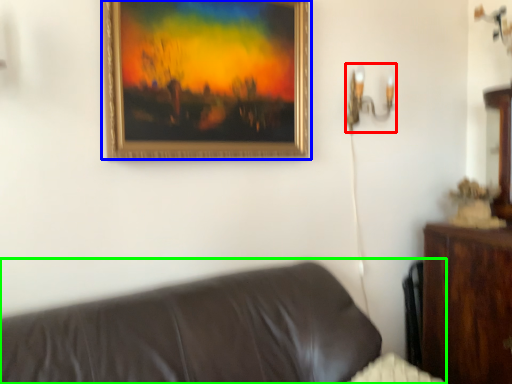
Question: Which object is the farthest from table lamp (highlighted by a red box)? Choose among these: picture frame (highlighted by a blue box) or studio couch (highlighted by a green box).

Choices:
 (A) picture frame
 (B) studio couch

Answer: (B)